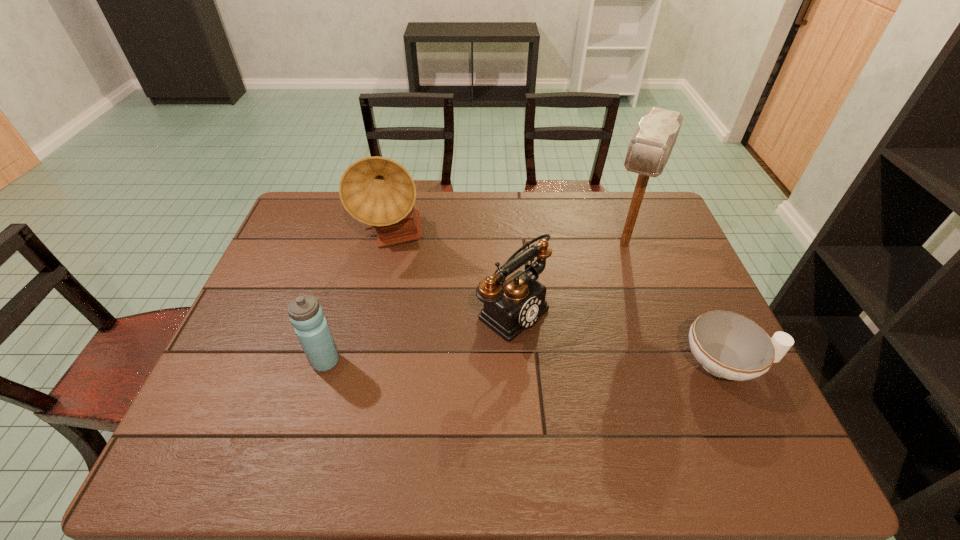
Locate an element on the screen. free spot on the desktop that is between the water bottle and the shortest object and is positioned on the horn of the fourth shortest object is located at coordinates (x=525, y=362).

Where is `vacant space on the desktop that is between the water bottle and the chinaware and is positioned on the front of the telephone at the rotary dial`? The image size is (960, 540). vacant space on the desktop that is between the water bottle and the chinaware and is positioned on the front of the telephone at the rotary dial is located at coordinates (586, 362).

This screenshot has width=960, height=540. What are the coordinates of `free space on the desktop that is between the water bottle and the chinaware and is positioned above the head of the mallet` in the screenshot? It's located at click(x=570, y=362).